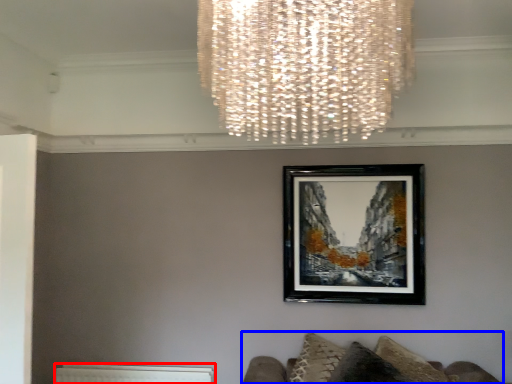
Question: Which of the following is the closest to the observer, radiator (highlighted by a red box) or furniture (highlighted by a blue box)?

Choices:
 (A) radiator
 (B) furniture

Answer: (B)